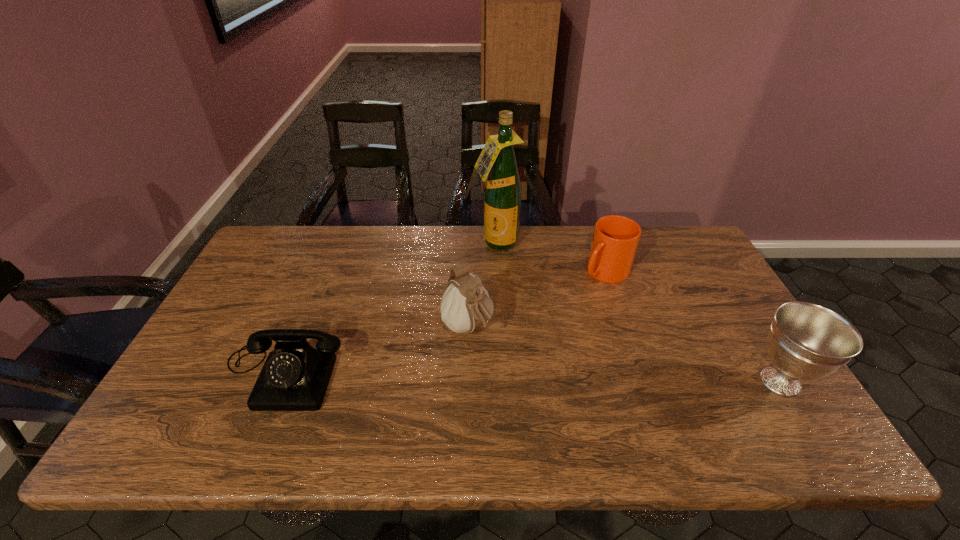
Where is `the leftmost object`? This screenshot has width=960, height=540. the leftmost object is located at coordinates (295, 376).

Locate an element on the screen. This screenshot has width=960, height=540. the shortest object is located at coordinates (295, 376).

The height and width of the screenshot is (540, 960). In order to click on chalice in this screenshot , I will do `click(806, 341)`.

Where is `the fourth object from left to right`? the fourth object from left to right is located at coordinates pyautogui.click(x=615, y=239).

Locate an element on the screen. The height and width of the screenshot is (540, 960). the second shortest object is located at coordinates (615, 239).

Locate an element on the screen. The height and width of the screenshot is (540, 960). pouch is located at coordinates pos(465,305).

Locate an element on the screen. The width and height of the screenshot is (960, 540). the tallest object is located at coordinates (502, 196).

Where is `the farthest object`? This screenshot has width=960, height=540. the farthest object is located at coordinates (502, 196).

You are a GUI agent. You are given a task and a screenshot of the screen. Output one action in this format:
    pyautogui.click(x=<x>, y=<y>)
    Task: Click on the free space located on the back of the chalice
    The image size is (960, 540).
    Given the screenshot: What is the action you would take?
    pyautogui.click(x=724, y=289)

This screenshot has width=960, height=540. I want to click on free location located on the handle side of the fourth object from left to right, so click(583, 293).